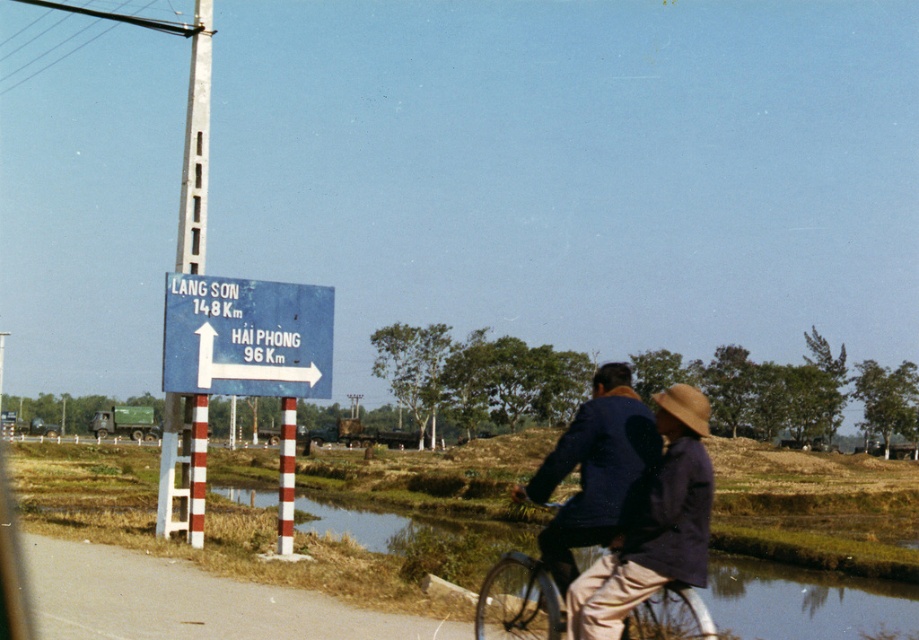
Question: From the image, what is the correct spatial relationship of green grass at lower center in relation to metallic silver bicycle at center?

Choices:
 (A) right
 (B) left

Answer: (B)

Question: Observing the image, what is the correct spatial positioning of blue painted metal sign at upper left in reference to white striped pole at center?

Choices:
 (A) right
 (B) left

Answer: (A)

Question: Among these points, which one is farthest from the camera?

Choices:
 (A) (535, 580)
 (B) (280, 509)
 (C) (668, 426)
 (D) (319, 385)

Answer: (D)

Question: Where is white painted metal pole at upper left located in relation to metallic silver bicycle at center in the image?

Choices:
 (A) below
 (B) above

Answer: (B)

Question: Estimate the real-world distances between objects in this image. Which object is farther from the white striped pole at center?

Choices:
 (A) dark blue fabric jacket at center
 (B) white painted metal pole at upper left

Answer: (A)

Question: Which object is positioned closest to the dark blue fabric jacket at center?

Choices:
 (A) green grass at lower center
 (B) white painted metal pole at upper left
 (C) metallic silver bicycle at center
 (D) white striped pole at center

Answer: (C)